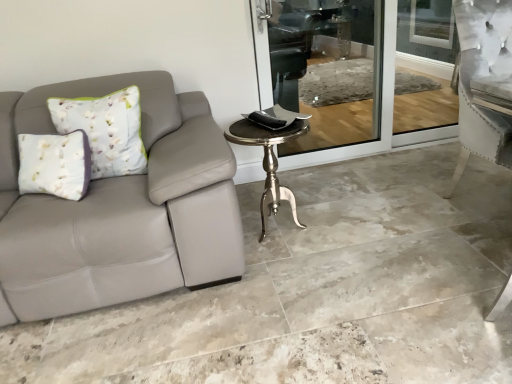
Locate an element on the screen. spots to the right of polished brass table at center is located at coordinates (351, 225).